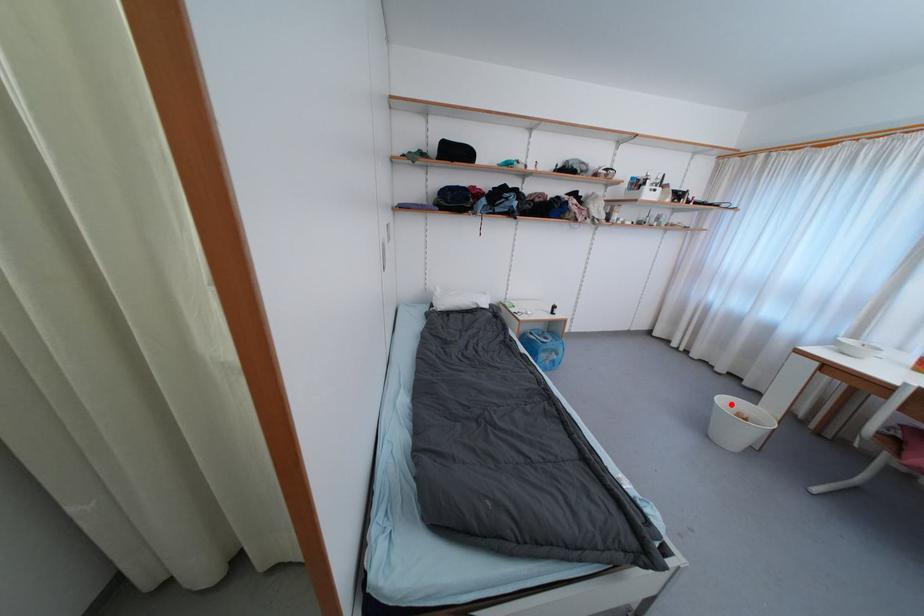
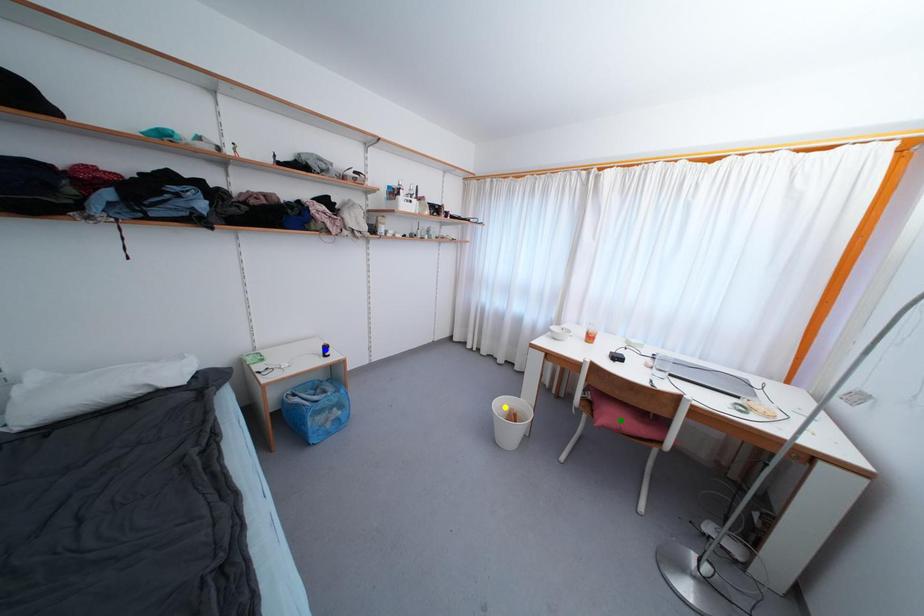
Question: I am providing you with two images of the same scene from different viewpoints. A red point is marked on the first image. You are given multiple points on the second image. Can you choose the point in image 2 that corresponds to the point in image 1?

Choices:
 (A) green point
 (B) blue point
 (C) yellow point

Answer: (C)